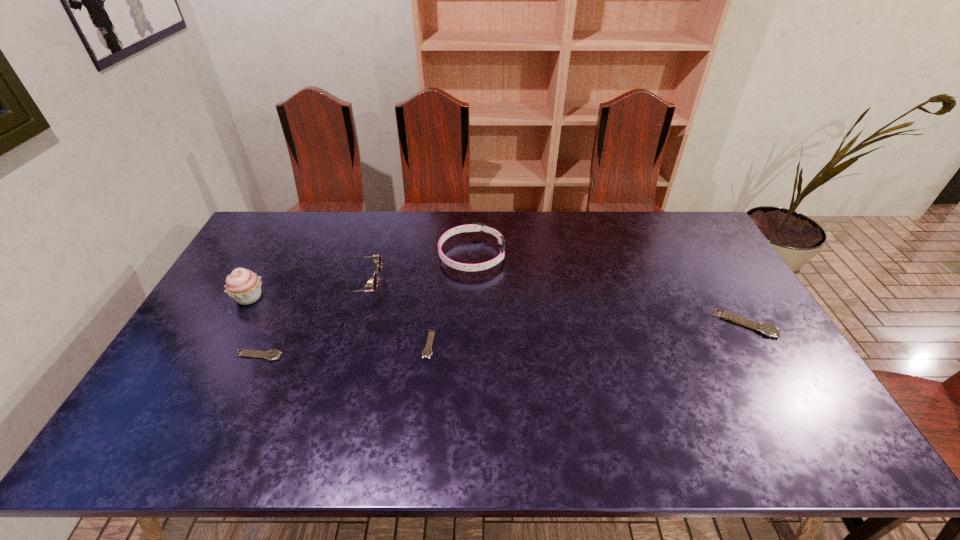
Find the location of a particular element. free point between the rightmost watch and the fifth tallest object is located at coordinates (502, 340).

You are a GUI agent. You are given a task and a screenshot of the screen. Output one action in this format:
    pyautogui.click(x=<x>, y=<y>)
    Task: Click on the vacant space that is in between the second shortest watch and the fifth shortest object
    This screenshot has height=540, width=960.
    Given the screenshot: What is the action you would take?
    pyautogui.click(x=308, y=320)

Find the location of `vacant point located between the sunglasses and the dog collar`. vacant point located between the sunglasses and the dog collar is located at coordinates (415, 270).

Identify the location of free spot between the shortest watch and the leftmost watch. The height and width of the screenshot is (540, 960). (344, 350).

You are a GUI agent. You are given a task and a screenshot of the screen. Output one action in this format:
    pyautogui.click(x=<x>, y=<y>)
    Task: Click on the empty space between the cupcake and the dog collar
    Image resolution: width=960 pixels, height=540 pixels.
    Given the screenshot: What is the action you would take?
    pyautogui.click(x=360, y=276)

The image size is (960, 540). What are the coordinates of `free spot between the leftmost watch and the tallest object` in the screenshot? It's located at (253, 327).

I want to click on object that is the fifth closest one to the dog collar, so click(767, 329).

Locate which object is the second closest to the leftmost watch. Please provide its 2D coordinates. Your answer should be formatted as a tuple, i.e. [(x, y)], where the tuple contains the x and y coordinates of a point satisfying the conditions above.

[(377, 259)]

Identify the location of watch that stands as the closest to the shortest watch. The image size is (960, 540). (271, 355).

Point out which watch is positioned as the third nearest to the cupcake. Please provide its 2D coordinates. Your answer should be formatted as a tuple, i.e. [(x, y)], where the tuple contains the x and y coordinates of a point satisfying the conditions above.

[(767, 329)]